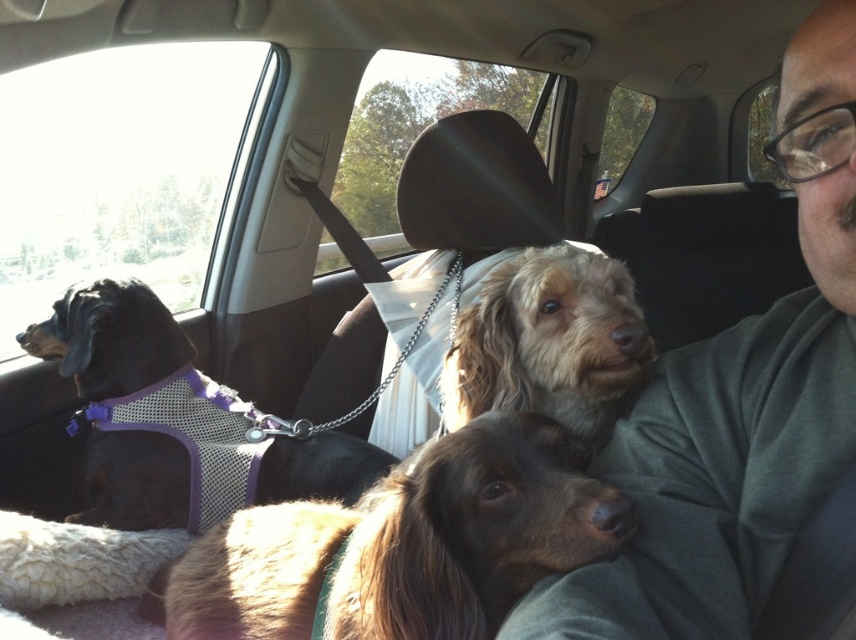
Does brown fur dog at center have a smaller size compared to black mesh vest at left?

Yes.

What do you see at coordinates (405, 545) in the screenshot?
I see `brown fur dog at center` at bounding box center [405, 545].

Image resolution: width=856 pixels, height=640 pixels. In order to click on brown fur dog at center in this screenshot , I will do `click(405, 545)`.

Is gray cotton shirt at center shorter than fuzzy brown dog at center?

In fact, gray cotton shirt at center may be taller than fuzzy brown dog at center.

Does gray cotton shirt at center have a larger size compared to fuzzy brown dog at center?

Yes, gray cotton shirt at center is bigger than fuzzy brown dog at center.

This screenshot has width=856, height=640. I want to click on gray cotton shirt at center, so click(738, 406).

Between black mesh vest at left and fuzzy brown dog at center, which one appears on the left side from the viewer's perspective?

From the viewer's perspective, black mesh vest at left appears more on the left side.

This screenshot has width=856, height=640. In order to click on black mesh vest at left in this screenshot , I will do `click(175, 420)`.

Image resolution: width=856 pixels, height=640 pixels. Identify the location of black mesh vest at left. (175, 420).